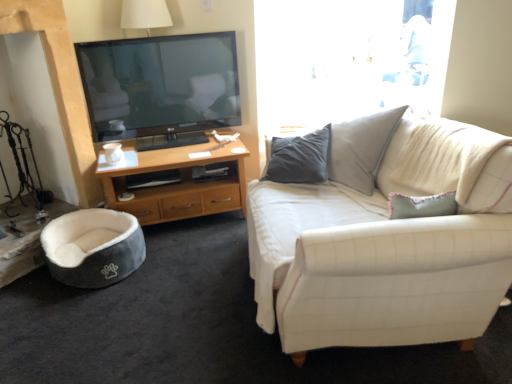
The image size is (512, 384). In order to click on space that is in front of woodendesk at left in this screenshot , I will do `click(177, 278)`.